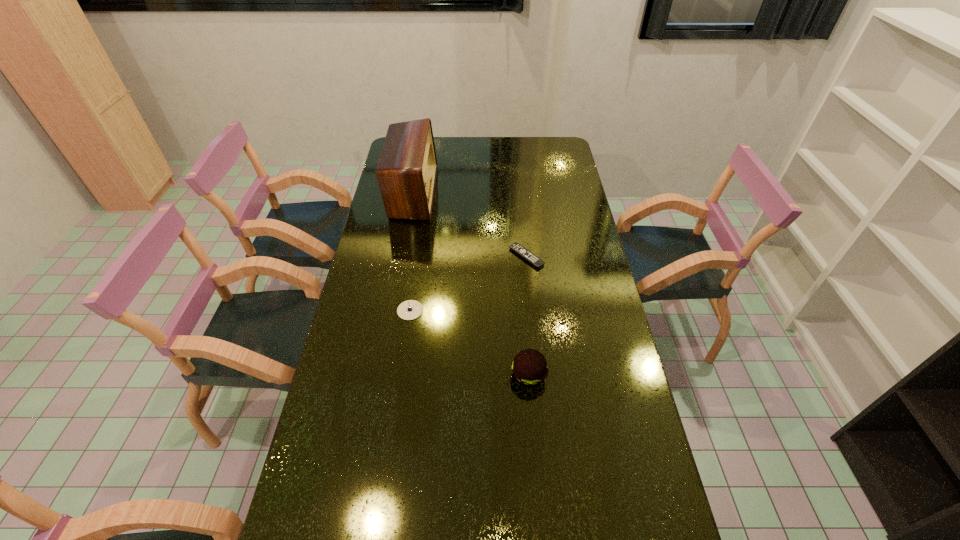
Identify the location of the farthest object. pos(406,171).

The width and height of the screenshot is (960, 540). Identify the location of radio receiver. (406, 171).

The height and width of the screenshot is (540, 960). Identify the location of the third shortest object. (529, 367).

This screenshot has height=540, width=960. Find the location of `the nearest object`. the nearest object is located at coordinates (529, 367).

The height and width of the screenshot is (540, 960). I want to click on compass, so click(408, 310).

This screenshot has width=960, height=540. In order to click on the second nearest object in this screenshot , I will do `click(408, 310)`.

You are a GUI agent. You are given a task and a screenshot of the screen. Output one action in this format:
    pyautogui.click(x=<x>, y=<y>)
    Task: Click on the shortest object
    
    Given the screenshot: What is the action you would take?
    pyautogui.click(x=520, y=250)

Find the location of a particular element. The height and width of the screenshot is (540, 960). remote control is located at coordinates (520, 250).

Identify the location of vacant area located 0.170m on the front-facing side of the tallest object. (475, 193).

You are a GUI agent. You are given a task and a screenshot of the screen. Output one action in this format:
    pyautogui.click(x=<x>, y=<y>)
    Task: Click on the vacant space located on the left of the second tallest object
    This screenshot has width=960, height=540.
    Given the screenshot: What is the action you would take?
    pyautogui.click(x=390, y=375)